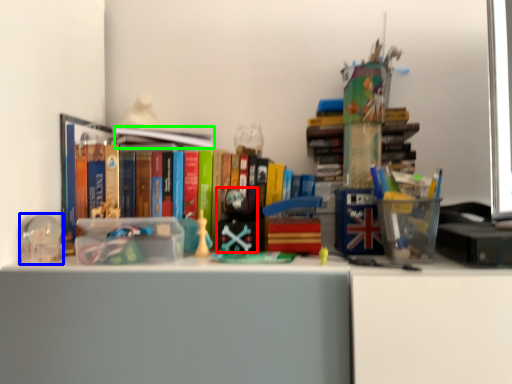
Question: Estimate the real-world distances between objects in this image. Which object is closer to toy (highlighted by a red box), stationery (highlighted by a blue box) or book (highlighted by a green box)?

Choices:
 (A) stationery
 (B) book

Answer: (B)